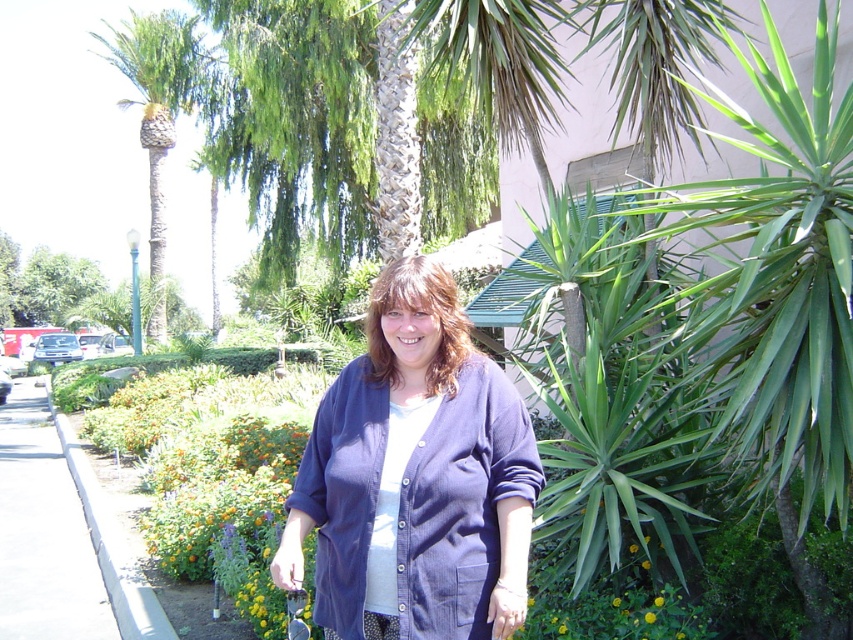
You are a gardener who needs to plant a new flower bed along the gray concrete sidewalk at lower left. Considering the proximity to the green leafy palm tree at left, which object might cast a shadow over the sidewalk during the afternoon? Explain your reasoning.

The green leafy palm tree at left is taller than the gray concrete sidewalk at lower left, so it will cast a shadow over the sidewalk during the afternoon.

You are designing a layout for a small outdoor event and need to place a table where the blue corduroy cardigan at center is currently located. Since space is limited, will the table fit if the gray concrete sidewalk at lower left is nearby?

The blue corduroy cardigan at center occupies less space than the gray concrete sidewalk at lower left, so the table should fit in the space where the cardigan is located as it is smaller than the sidewalk area.